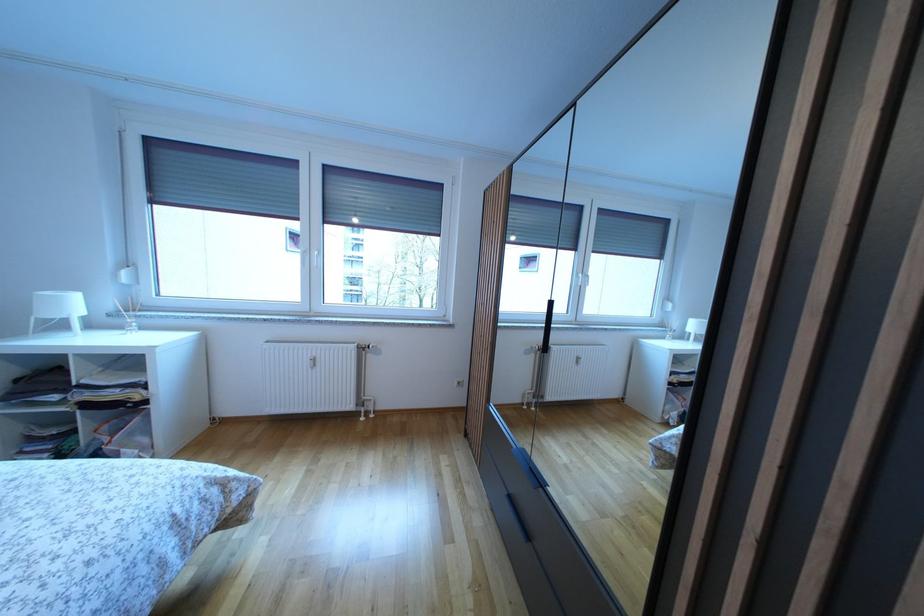
Locate an element on the screen. The height and width of the screenshot is (616, 924). white radiator knob is located at coordinates (310, 363).